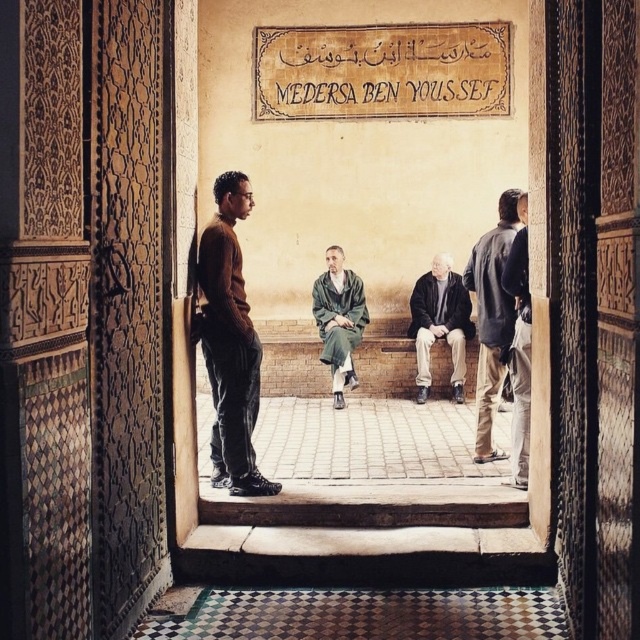
From the picture: You are standing inside Medersa Ben Youssef and looking out through the carved wooden door frame. You see two jackets hanging on a wall at the right side of the courtyard. Which jacket is closer to the right edge of the wall? The jackets are labeled as dark gray jacket at right and dark brown leather jacket at right.

The dark gray jacket at right is closer to the right edge of the wall because it is positioned to the right of the dark brown leather jacket at right.

Consider the image. You are an interior designer assessing the seating arrangement in the courtyard of Medersa Ben Youssef. You notice the brown sweater at center and the green textured robe at center. Which object takes up more space in the scene?

The green textured robe at center takes up more space in the scene than the brown sweater at center, as the brown sweater at center occupies less space than the green textured robe at center.